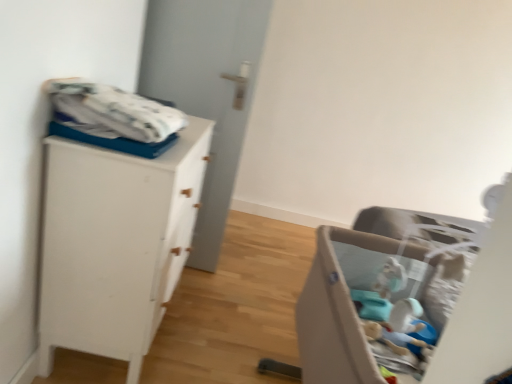
Question: From the image's perspective, would you say white cotton blanket at upper left is shown under beige fabric playpen at lower right?

Choices:
 (A) no
 (B) yes

Answer: (A)

Question: Is white cotton blanket at upper left thinner than beige fabric playpen at lower right?

Choices:
 (A) yes
 (B) no

Answer: (A)

Question: Is white cotton blanket at upper left touching beige fabric playpen at lower right?

Choices:
 (A) no
 (B) yes

Answer: (A)

Question: Is white cotton blanket at upper left wider than beige fabric playpen at lower right?

Choices:
 (A) no
 (B) yes

Answer: (A)

Question: From a real-world perspective, is white cotton blanket at upper left physically below beige fabric playpen at lower right?

Choices:
 (A) no
 (B) yes

Answer: (A)

Question: In terms of width, does white matte door at center look wider or thinner when compared to white matte cabinet at left?

Choices:
 (A) thin
 (B) wide

Answer: (A)

Question: Is white matte door at center in front of or behind white matte cabinet at left in the image?

Choices:
 (A) front
 (B) behind

Answer: (B)

Question: From the image's perspective, relative to white matte cabinet at left, is white matte door at center above or below?

Choices:
 (A) above
 (B) below

Answer: (A)

Question: Is white matte door at center bigger or smaller than white matte cabinet at left?

Choices:
 (A) small
 (B) big

Answer: (A)

Question: Is white cotton blanket at upper left taller or shorter than white matte cabinet at left?

Choices:
 (A) short
 (B) tall

Answer: (A)

Question: From the image's perspective, relative to white matte cabinet at left, is white cotton blanket at upper left above or below?

Choices:
 (A) below
 (B) above

Answer: (B)

Question: Is white cotton blanket at upper left bigger or smaller than white matte cabinet at left?

Choices:
 (A) small
 (B) big

Answer: (A)

Question: From a real-world perspective, is white cotton blanket at upper left positioned above or below white matte cabinet at left?

Choices:
 (A) below
 (B) above

Answer: (B)

Question: In the image, is beige fabric playpen at lower right positioned in front of or behind white matte cabinet at left?

Choices:
 (A) front
 (B) behind

Answer: (A)

Question: Is point (506, 304) closer or farther from the camera than point (76, 203)?

Choices:
 (A) farther
 (B) closer

Answer: (B)